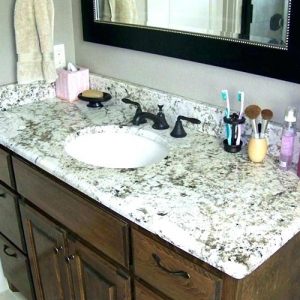
Where is `soap`? This screenshot has height=300, width=300. soap is located at coordinates (90, 93).